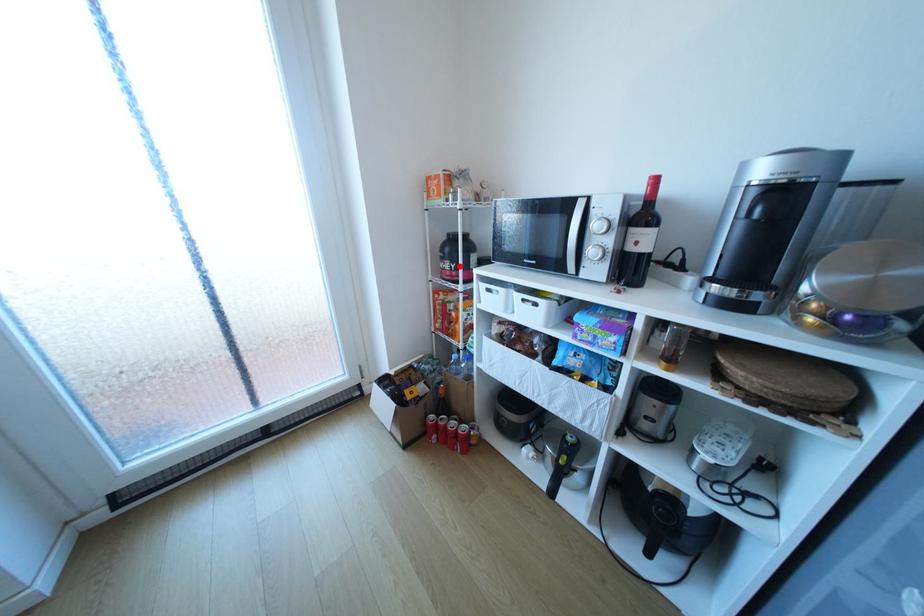
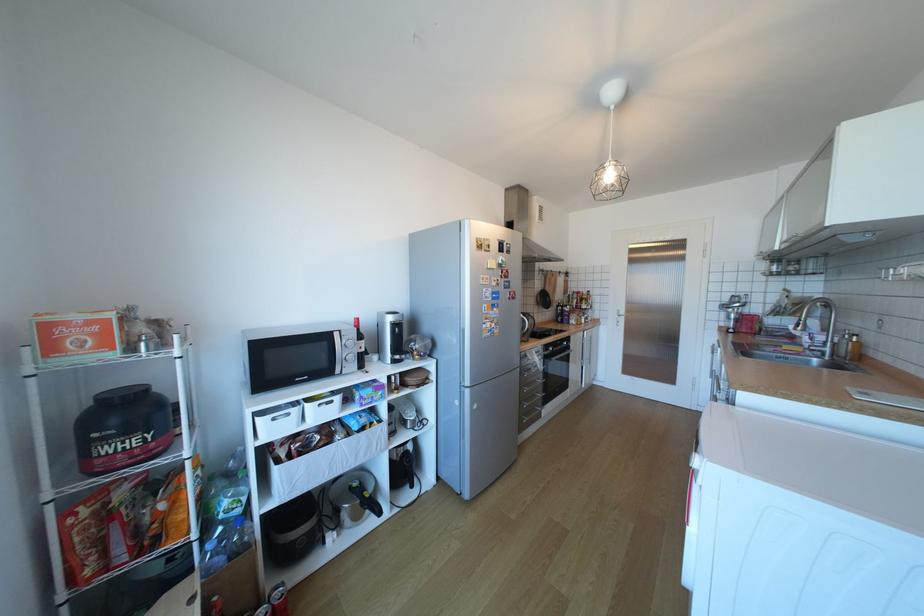
Find the pixel in the second image that matches the highlighted location in the first image.

(152, 439)